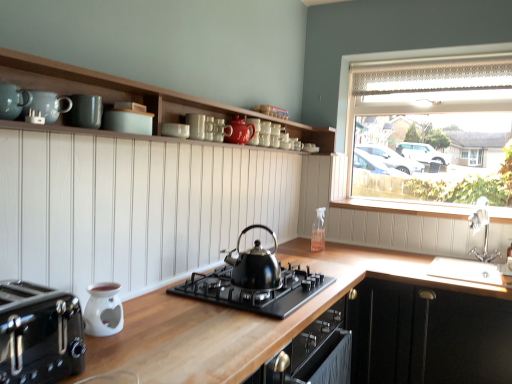
You are a GUI agent. You are given a task and a screenshot of the screen. Output one action in this format:
    pyautogui.click(x=<x>, y=<y>)
    Task: Click on the space that is in front of black polished kettle at center
    This screenshot has height=384, width=512.
    Given the screenshot: What is the action you would take?
    pyautogui.click(x=238, y=318)